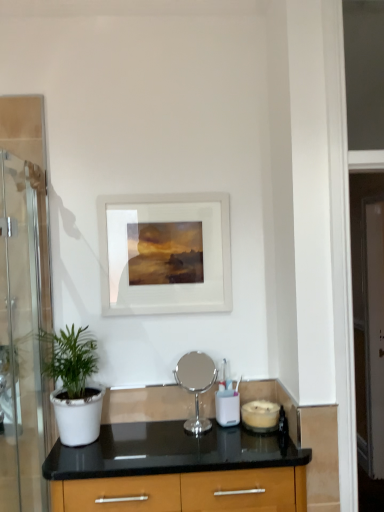
Question: In terms of width, does matte glass candle at lower right, the first appliance when ordered from right to left, look wider or thinner when compared to green matte plant at left?

Choices:
 (A) thin
 (B) wide

Answer: (A)

Question: Relative to green matte plant at left, is matte glass candle at lower right, the 2th appliance positioned from the left, in front or behind?

Choices:
 (A) front
 (B) behind

Answer: (B)

Question: Which object is positioned closest to the white glossy screen door at right, arranged as the 1th screen door when viewed from the right?

Choices:
 (A) green matte plant at left
 (B) matte glass candle at lower right, the 2th appliance positioned from the left
 (C) white matte picture frame at center
 (D) silver metallic mirror at center, the first appliance in the left-to-right sequence
 (E) transparent glass screen door at left, placed as the first screen door when sorted from left to right

Answer: (C)

Question: Based on their relative distances, which object is nearer to the white glossy screen door at right, arranged as the 1th screen door when viewed from the right?

Choices:
 (A) transparent glass screen door at left, placed as the first screen door when sorted from left to right
 (B) white matte picture frame at center
 (C) matte glass candle at lower right, the 2th appliance positioned from the left
 (D) green matte plant at left
 (E) silver metallic mirror at center, marked as the second appliance in a right-to-left arrangement

Answer: (B)